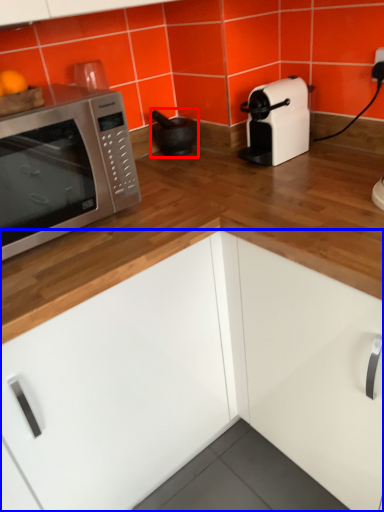
Question: Which point is closer to the camera, appliance (highlighted by a red box) or cabinetry (highlighted by a blue box)?

Choices:
 (A) appliance
 (B) cabinetry

Answer: (B)